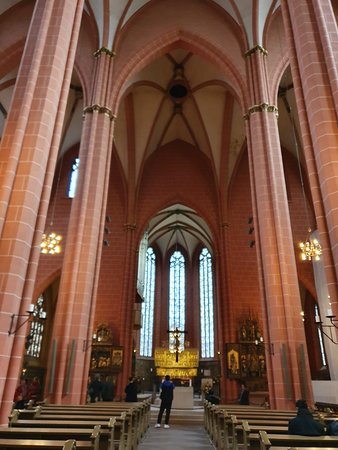
Identify the location of gray flooring. Image resolution: width=338 pixels, height=450 pixels. (180, 442).